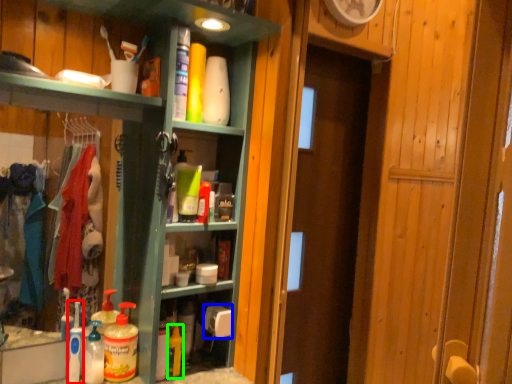
Question: Which object is positioned farthest from cleaning product (highlighted by a red box)? Select from toilet paper (highlighted by a blue box) and cleaning product (highlighted by a green box).

Choices:
 (A) toilet paper
 (B) cleaning product

Answer: (A)